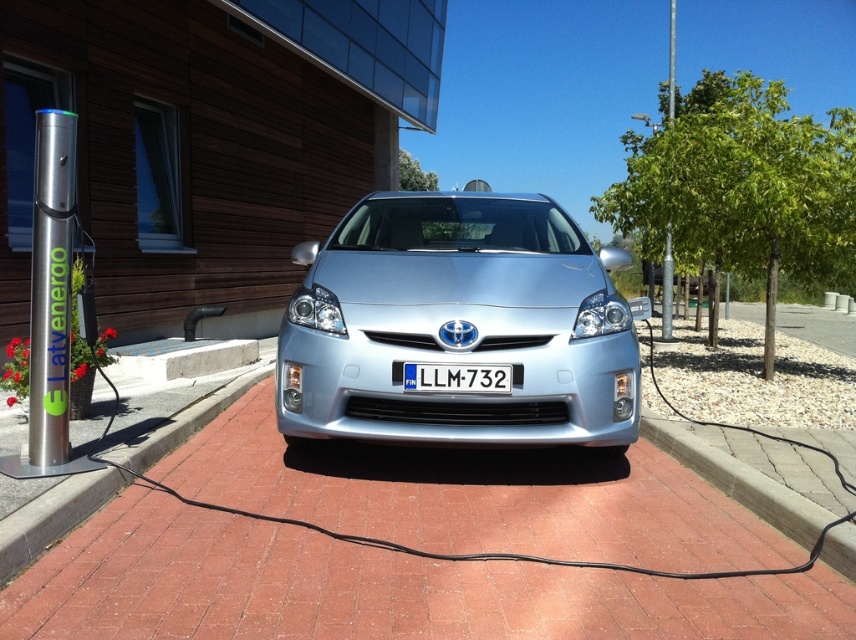
You are a delivery robot with a 36 inch wide package. You need to move from the silver brick pavement at center to the satin silver car at center. Can you fit through the space between them?

The silver brick pavement at center is 35.64 inches away from the satin silver car at center. Since your package is 36 inches wide, it is slightly wider than the available space. You cannot fit through the space between them.

You are standing at the silver Toyota Prius parked on the red brick surface. You need to walk directly to the point marked by the coordinates point (369, 589). Which direction should you face to walk straight towards that point?

The point (369, 589) corresponds to the silver brick pavement at center. Since you are at the silver Toyota Prius parked on the red brick surface, you should face towards the center of the parking area to walk straight towards the silver brick pavement at center.

You are a delivery driver who needs to park your car between the silver brick pavement at center and the brick at lower left. Based on the scene, can you determine which brick area is closer to the charging station?

The silver brick pavement at center is in front of brick at lower left, meaning it is closer to the charging station. Therefore, you should park closer to the silver brick pavement at center.